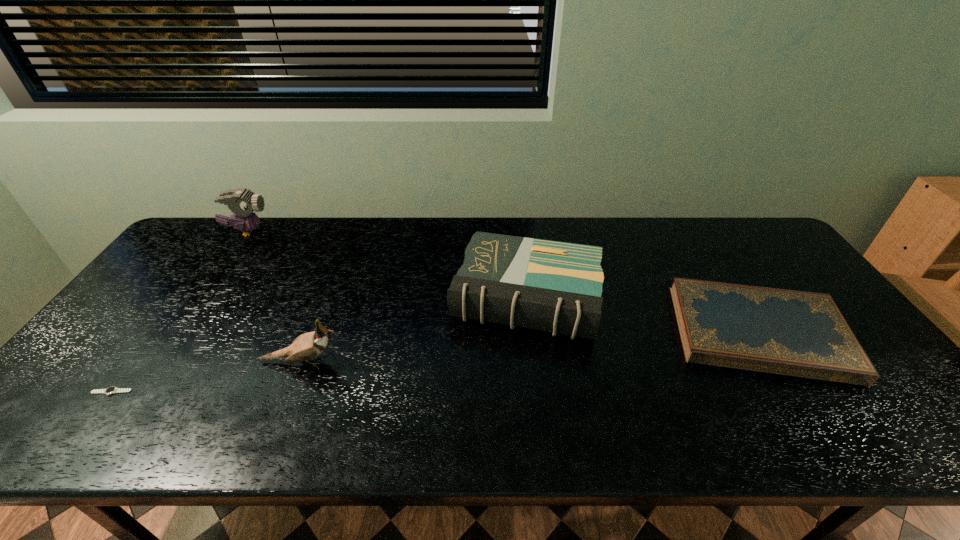
Locate an element on the screen. This screenshot has height=540, width=960. free space located at the face of the nearer bird is located at coordinates (506, 362).

I want to click on free space located 0.220m on the left of the third shortest object, so click(373, 297).

Locate an element on the screen. The height and width of the screenshot is (540, 960). vacant area located on the left of the shorter paperback book is located at coordinates (520, 332).

Find the location of a particular element. The height and width of the screenshot is (540, 960). vacant space situated 0.380m on the back of the shortest object is located at coordinates (194, 280).

The image size is (960, 540). Find the location of `bird at the far edge`. bird at the far edge is located at coordinates (242, 202).

The height and width of the screenshot is (540, 960). I want to click on paperback book at the far edge, so click(552, 286).

The width and height of the screenshot is (960, 540). Identify the location of bird at the left edge. (242, 202).

Locate an element on the screen. This screenshot has width=960, height=540. watch at the left edge is located at coordinates (111, 390).

Where is `object located in the right edge section of the desktop`? Image resolution: width=960 pixels, height=540 pixels. object located in the right edge section of the desktop is located at coordinates (803, 334).

The height and width of the screenshot is (540, 960). I want to click on object that is at the far left corner, so click(x=242, y=202).